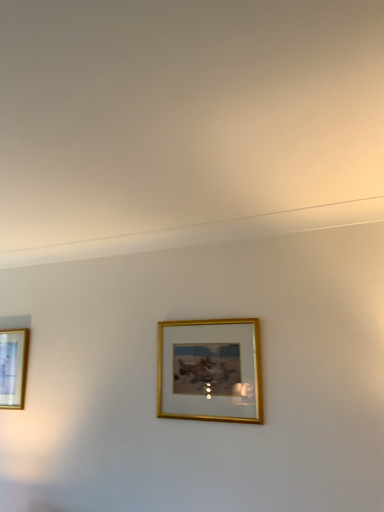
Question: From a real-world perspective, relative to gold metallic picture frame at center, placed as the first picture frame when sorted from front to back, is gold-framed picture at left, which is the second picture frame from right to left, vertically above or below?

Choices:
 (A) above
 (B) below

Answer: (B)

Question: Choose the correct answer: Is gold-framed picture at left, arranged as the first picture frame when viewed from the left, inside gold metallic picture frame at center, the 2th picture frame positioned from the left, or outside it?

Choices:
 (A) outside
 (B) inside

Answer: (A)

Question: Is gold-framed picture at left, arranged as the first picture frame when viewed from the left, bigger or smaller than gold metallic picture frame at center, placed as the first picture frame when sorted from front to back?

Choices:
 (A) big
 (B) small

Answer: (B)

Question: From a real-world perspective, is gold metallic picture frame at center, the 2th picture frame positioned from the left, physically located above or below gold-framed picture at left, which is the second picture frame from right to left?

Choices:
 (A) above
 (B) below

Answer: (A)

Question: Is gold metallic picture frame at center, acting as the first picture frame starting from the right, inside the boundaries of gold-framed picture at left, the 1th picture frame positioned from the back, or outside?

Choices:
 (A) inside
 (B) outside

Answer: (B)

Question: From the image's perspective, relative to gold-framed picture at left, which is counted as the 2th picture frame, starting from the front, is gold metallic picture frame at center, which is the second picture frame in back-to-front order, above or below?

Choices:
 (A) above
 (B) below

Answer: (A)

Question: In terms of size, does gold metallic picture frame at center, acting as the first picture frame starting from the right, appear bigger or smaller than gold-framed picture at left, which is counted as the 2th picture frame, starting from the front?

Choices:
 (A) big
 (B) small

Answer: (A)